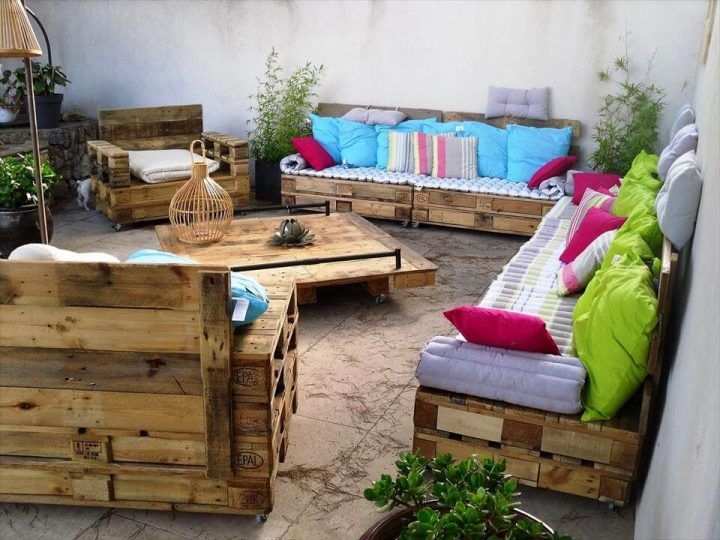
This screenshot has height=540, width=720. What are the coordinates of `floor` in the screenshot? It's located at (379, 393).